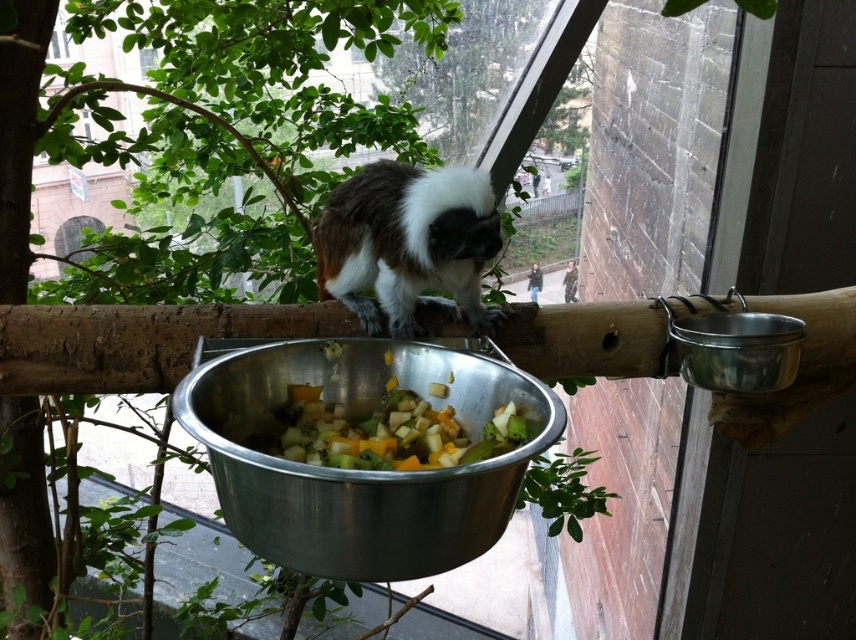
Question: Does metallic silver bowl at center have a greater width compared to fluffy white monkey at center?

Choices:
 (A) yes
 (B) no

Answer: (A)

Question: Where is metallic silver bowl at center located in relation to metallic silver bowl at upper right in the image?

Choices:
 (A) below
 (B) above

Answer: (A)

Question: Is fluffy white monkey at center bigger than multicolored diced vegetables at center?

Choices:
 (A) no
 (B) yes

Answer: (B)

Question: Which point is farther to the camera?

Choices:
 (A) coord(715,317)
 (B) coord(503,497)
 (C) coord(431,225)
 (D) coord(419,401)

Answer: (A)

Question: Which object is closer to the camera taking this photo?

Choices:
 (A) metallic silver bowl at upper right
 (B) multicolored diced vegetables at center

Answer: (B)

Question: Estimate the real-world distances between objects in this image. Which object is closer to the multicolored diced vegetables at center?

Choices:
 (A) metallic silver bowl at upper right
 (B) fluffy white monkey at center
 (C) metallic silver bowl at center

Answer: (C)